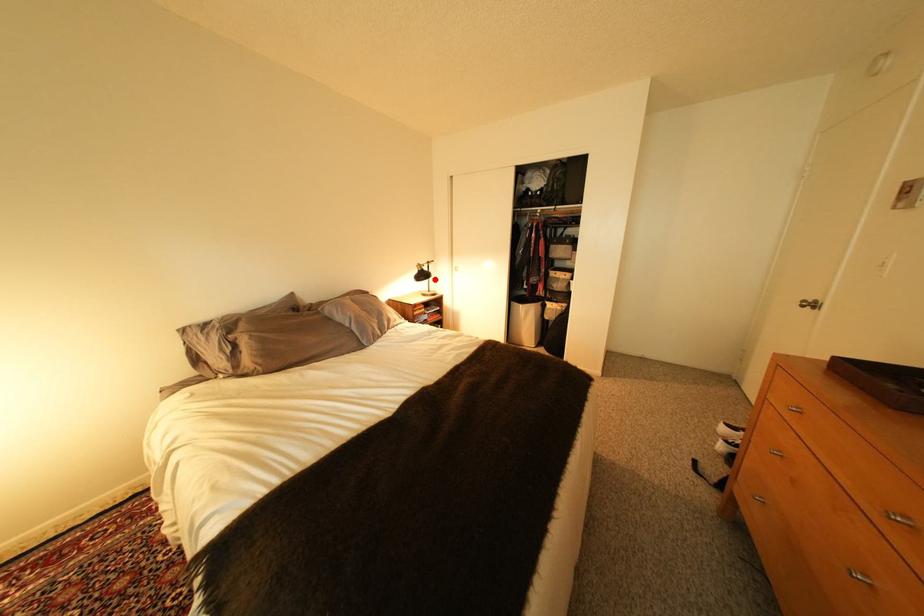
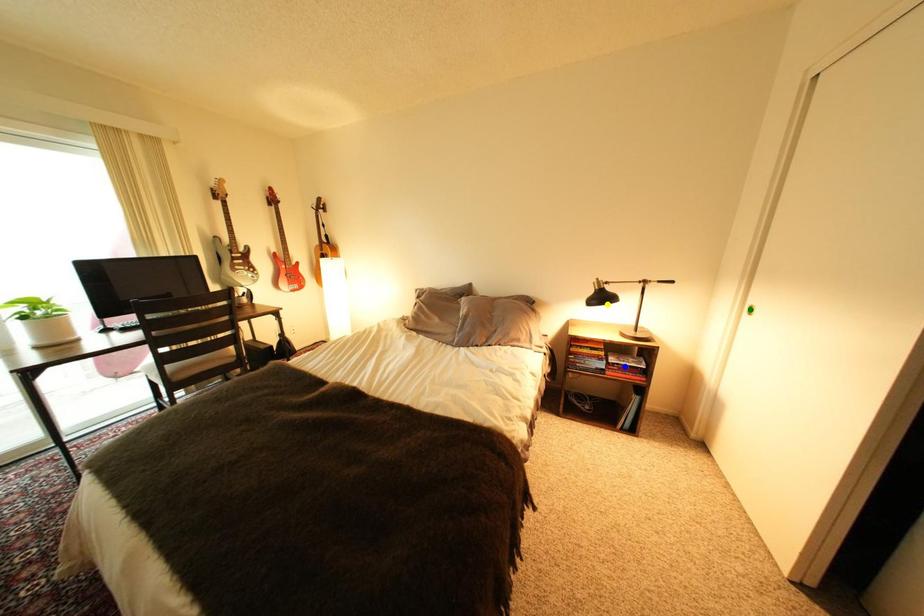
Question: I am providing you with two images of the same scene from different viewpoints. A red point is marked on the first image. You are given multiple points on the second image. Can you choose the point in image 2 that corresponds to the point in image 1?

Choices:
 (A) yellow point
 (B) blue point
 (C) green point

Answer: (A)